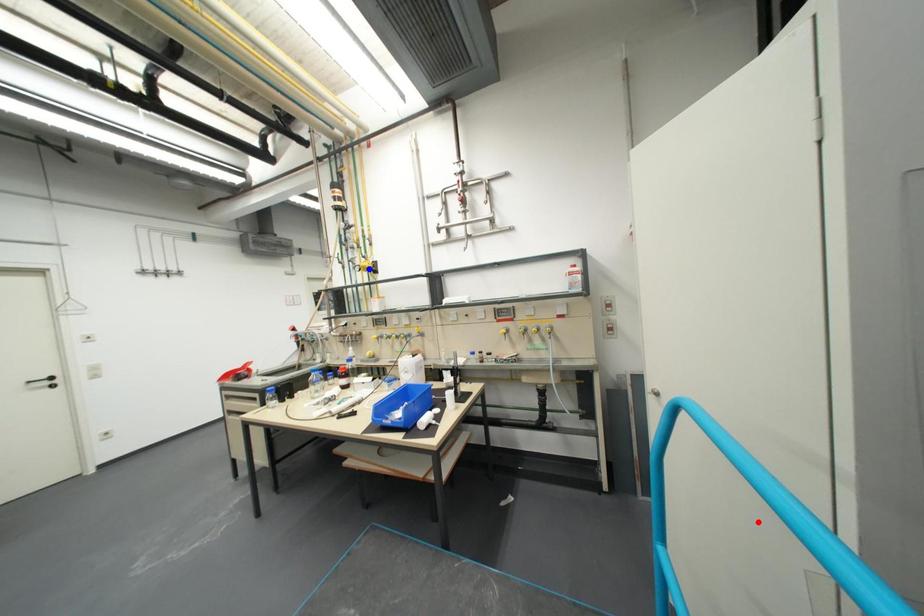
Question: In the image, two points are highlighted. Which point is nearer to the camera? Reply with the corresponding letter.

Choices:
 (A) blue point
 (B) red point

Answer: (B)